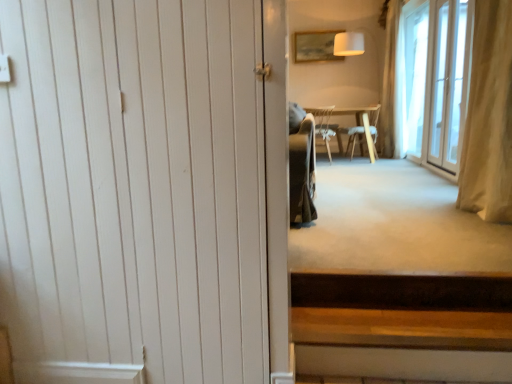
At what (x,y) coordinates should I click in order to perform the action: click on light brown wooden chair at center, the first chair viewed from the right. Please return your answer as a coordinate pair (x, y). The width and height of the screenshot is (512, 384). Looking at the image, I should click on (362, 128).

This screenshot has height=384, width=512. What do you see at coordinates (145, 191) in the screenshot? I see `white wood door at left` at bounding box center [145, 191].

Where is `wooden stairs at lower right`? Image resolution: width=512 pixels, height=384 pixels. wooden stairs at lower right is located at coordinates (402, 325).

The image size is (512, 384). Identify the location of beige fabric curtain at right, acting as the second curtain starting from the back. (489, 117).

What do you see at coordinates (489, 117) in the screenshot? Image resolution: width=512 pixels, height=384 pixels. I see `beige fabric curtain at right, which is counted as the 2th curtain, starting from the right` at bounding box center [489, 117].

Consider the image. Measure the distance between point (320, 110) and camera.

The depth of point (320, 110) is 20.62 feet.

Locate an element on the screen. The image size is (512, 384). light brown wooden chair at center, the first chair viewed from the right is located at coordinates (362, 128).

Does transparent glass door at right appear on the right side of light brown wooden chair at center, the first chair viewed from the right?

Yes.

Are transparent glass door at right and light brown wooden chair at center, positioned as the second chair in left-to-right order, far apart?

Actually, transparent glass door at right and light brown wooden chair at center, positioned as the second chair in left-to-right order, are a little close together.

From the image's perspective, is transparent glass door at right located above light brown wooden chair at center, the first chair viewed from the right?

Yes.

Is transparent glass door at right thinner than beige fabric curtain at right, arranged as the first curtain when viewed from the front?

Yes.

From the image's perspective, which one is positioned lower, transparent glass door at right or beige fabric curtain at right, which is counted as the 2th curtain, starting from the right?

beige fabric curtain at right, which is counted as the 2th curtain, starting from the right.

Is point (415, 146) closer or farther from the camera than point (502, 32)?

Point (415, 146) is positioned farther from the camera compared to point (502, 32).

Considering the sizes of objects transparent glass door at right and beige fabric curtain at right, which is the first curtain from left to right, in the image provided, who is taller, transparent glass door at right or beige fabric curtain at right, which is the first curtain from left to right,?

With more height is transparent glass door at right.

Measure the distance from beige fabric curtain at right, which is counted as the 2th curtain, starting from the right, to transparent glass door at right.

A distance of 2.54 meters exists between beige fabric curtain at right, which is counted as the 2th curtain, starting from the right, and transparent glass door at right.

The image size is (512, 384). In order to click on curtain below the transparent glass door at right (from the image's perspective) in this screenshot , I will do `click(489, 117)`.

Based on the photo, from a real-world perspective, who is located higher, beige fabric curtain at right, arranged as the first curtain when viewed from the front, or transparent glass door at right?

In real-world perspective, transparent glass door at right is above.

Is beige fabric curtain at right, arranged as the first curtain when viewed from the front, surrounding transparent glass door at right?

No, transparent glass door at right is located outside of beige fabric curtain at right, arranged as the first curtain when viewed from the front.

Is there a large distance between wooden stairs at lower right and matte gray chair at center, the 2th chair in the right-to-left sequence?

Yes, wooden stairs at lower right and matte gray chair at center, the 2th chair in the right-to-left sequence, are located far from each other.

How far apart are wooden stairs at lower right and matte gray chair at center, placed as the 1th chair when sorted from left to right?

The distance of wooden stairs at lower right from matte gray chair at center, placed as the 1th chair when sorted from left to right, is 4.38 meters.

From their relative heights in the image, would you say wooden stairs at lower right is taller or shorter than matte gray chair at center, placed as the 1th chair when sorted from left to right?

Considering their sizes, wooden stairs at lower right has less height than matte gray chair at center, placed as the 1th chair when sorted from left to right.

Considering the relative sizes of wooden stairs at lower right and matte gray chair at center, the 2th chair in the right-to-left sequence, in the image provided, is wooden stairs at lower right bigger than matte gray chair at center, the 2th chair in the right-to-left sequence,?

Actually, wooden stairs at lower right might be smaller than matte gray chair at center, the 2th chair in the right-to-left sequence.

Which is more to the left, matte gray chair at center, the 2th chair in the right-to-left sequence, or transparent glass door at right?

matte gray chair at center, the 2th chair in the right-to-left sequence.

Does point (330, 159) come closer to viewer compared to point (415, 142)?

No.

Is matte gray chair at center, the 2th chair in the right-to-left sequence, next to transparent glass door at right?

No, matte gray chair at center, the 2th chair in the right-to-left sequence, is not touching transparent glass door at right.

Can you confirm if light brown wooden chair at center, the first chair viewed from the right, is thinner than matte wooden picture frame at upper center?

No.

Is light brown wooden chair at center, the first chair viewed from the right, looking in the opposite direction of matte wooden picture frame at upper center?

No, light brown wooden chair at center, the first chair viewed from the right, is not facing the opposite direction of matte wooden picture frame at upper center.

Considering the relative positions of light brown wooden chair at center, the first chair viewed from the right, and matte wooden picture frame at upper center in the image provided, is light brown wooden chair at center, the first chair viewed from the right, in front of matte wooden picture frame at upper center?

Yes, the depth of light brown wooden chair at center, the first chair viewed from the right, is less than that of matte wooden picture frame at upper center.

From the image's perspective, who appears lower, light brown wooden chair at center, the first chair viewed from the right, or matte wooden picture frame at upper center?

From the image's view, light brown wooden chair at center, the first chair viewed from the right, is below.

Considering the positions of objects light brown wooden chair at center, positioned as the second chair in left-to-right order, and white sheer curtain at right, the 1th curtain from the back, in the image provided, who is behind, light brown wooden chair at center, positioned as the second chair in left-to-right order, or white sheer curtain at right, the 1th curtain from the back,?

light brown wooden chair at center, positioned as the second chair in left-to-right order, is more distant.

Locate an element on the screen. The height and width of the screenshot is (384, 512). the 2nd chair positioned below the white sheer curtain at right, placed as the 2th curtain when sorted from front to back (from a real-world perspective) is located at coordinates (362, 128).

Is point (356, 140) farther from viewer compared to point (388, 128)?

Yes, it is.

This screenshot has height=384, width=512. I want to click on chair that is the 1st one when counting downward from the transparent glass door at right (from the image's perspective), so click(362, 128).

This screenshot has height=384, width=512. In order to click on window screen on the right of beige fabric curtain at right, which is counted as the 2th curtain, starting from the right in this screenshot , I will do `click(415, 75)`.

When comparing their distances from matte wooden picture frame at upper center, does transparent glass door at right or beige fabric curtain at right, arranged as the first curtain when viewed from the front, seem closer?

Based on the image, transparent glass door at right appears to be nearer to matte wooden picture frame at upper center.

Looking at the image, which one is located closer to light brown wooden chair at center, the first chair viewed from the right, beige fabric curtain at right, acting as the second curtain starting from the back, or white wood door at left?

The object closer to light brown wooden chair at center, the first chair viewed from the right, is beige fabric curtain at right, acting as the second curtain starting from the back.

When comparing their distances from matte wooden picture frame at upper center, does beige fabric curtain at right, arranged as the first curtain when viewed from the front, or white wood door at left seem closer?

beige fabric curtain at right, arranged as the first curtain when viewed from the front, is closer to matte wooden picture frame at upper center.

From the image, which object appears to be farther from matte gray chair at center, the 2th chair in the right-to-left sequence, wooden stairs at lower right or white wood door at left?

Based on the image, white wood door at left appears to be further to matte gray chair at center, the 2th chair in the right-to-left sequence.

When comparing their distances from wooden stairs at lower right, does matte wooden picture frame at upper center or white sheer curtain at right, placed as the 2th curtain when sorted from front to back, seem closer?

white sheer curtain at right, placed as the 2th curtain when sorted from front to back, is closer to wooden stairs at lower right.

Estimate the real-world distances between objects in this image. Which object is closer to matte wooden picture frame at upper center, beige fabric curtain at right, which is counted as the 2th curtain, starting from the right, or wooden stairs at lower right?

Among the two, beige fabric curtain at right, which is counted as the 2th curtain, starting from the right, is located nearer to matte wooden picture frame at upper center.

From the image, which object appears to be farther from matte gray chair at center, the 2th chair in the right-to-left sequence, light brown wooden chair at center, the first chair viewed from the right, or transparent glass door at right?

transparent glass door at right is further to matte gray chair at center, the 2th chair in the right-to-left sequence.

Considering their positions, is matte gray chair at center, the 2th chair in the right-to-left sequence, positioned closer to white sheer curtain at right, which appears as the 1th curtain when viewed from the right, than light brown wooden chair at center, the first chair viewed from the right?

light brown wooden chair at center, the first chair viewed from the right.

Locate an element on the screen. This screenshot has width=512, height=384. window screen between beige fabric curtain at right, arranged as the first curtain when viewed from the front, and light brown wooden chair at center, the first chair viewed from the right, along the z-axis is located at coordinates (415, 75).

Image resolution: width=512 pixels, height=384 pixels. I want to click on curtain between wooden stairs at lower right and matte gray chair at center, placed as the 1th chair when sorted from left to right, along the z-axis, so click(489, 117).

Locate an element on the screen. The width and height of the screenshot is (512, 384). stairs located between white wood door at left and light brown wooden chair at center, the first chair viewed from the right, in the depth direction is located at coordinates [x=402, y=325].

Where is `window screen between beige fabric curtain at right, acting as the second curtain starting from the back, and white sheer curtain at right, the 1th curtain from the back, in the front-back direction`? The width and height of the screenshot is (512, 384). window screen between beige fabric curtain at right, acting as the second curtain starting from the back, and white sheer curtain at right, the 1th curtain from the back, in the front-back direction is located at coordinates (415, 75).